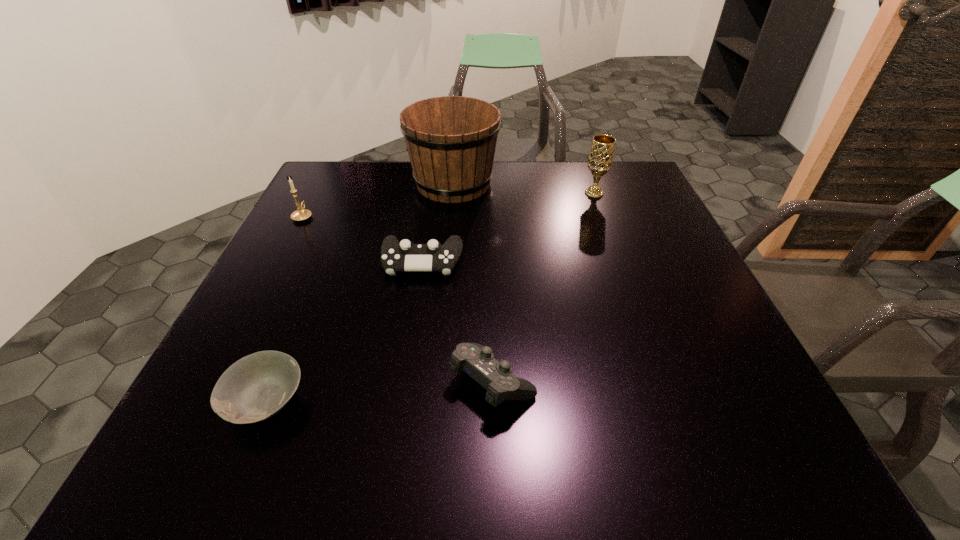
Where is `wine bucket`? The width and height of the screenshot is (960, 540). wine bucket is located at coordinates (451, 141).

The height and width of the screenshot is (540, 960). What are the coordinates of `the second tallest object` in the screenshot? It's located at (600, 159).

Identify the location of chalice. The image size is (960, 540). (600, 159).

This screenshot has width=960, height=540. In order to click on the leftmost object in this screenshot , I will do `click(301, 214)`.

Locate an element on the screen. The image size is (960, 540). candle holder is located at coordinates (301, 214).

Where is `the nearer control`? The image size is (960, 540). the nearer control is located at coordinates (478, 361).

You are a GUI agent. You are given a task and a screenshot of the screen. Output one action in this format:
    pyautogui.click(x=<x>, y=<y>)
    Task: Click on the third nearest object
    
    Given the screenshot: What is the action you would take?
    (x=405, y=256)

Locate an element on the screen. Image resolution: width=960 pixels, height=540 pixels. bowl is located at coordinates (256, 387).

Where is `the shortest object`? This screenshot has height=540, width=960. the shortest object is located at coordinates (256, 387).

The image size is (960, 540). In order to click on free space located on the right of the wine bucket in this screenshot , I will do `click(561, 184)`.